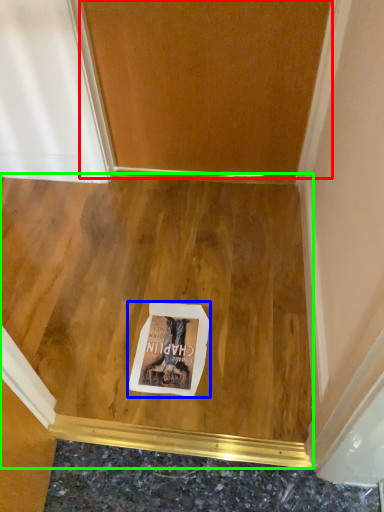
Question: Considering the real-world distances, which object is farthest from door (highlighted by a red box)? postcard (highlighted by a blue box) or plywood (highlighted by a green box)?

Choices:
 (A) postcard
 (B) plywood

Answer: (A)